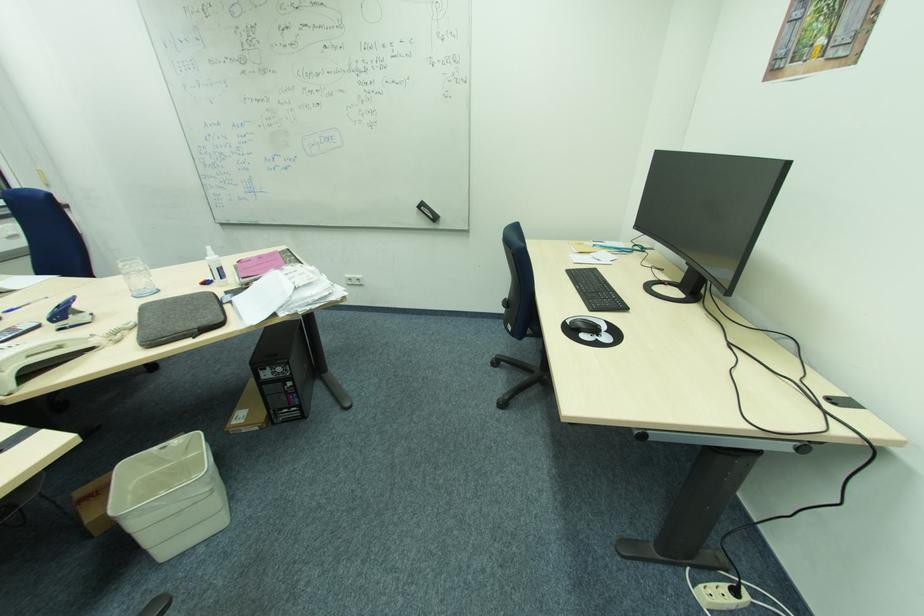
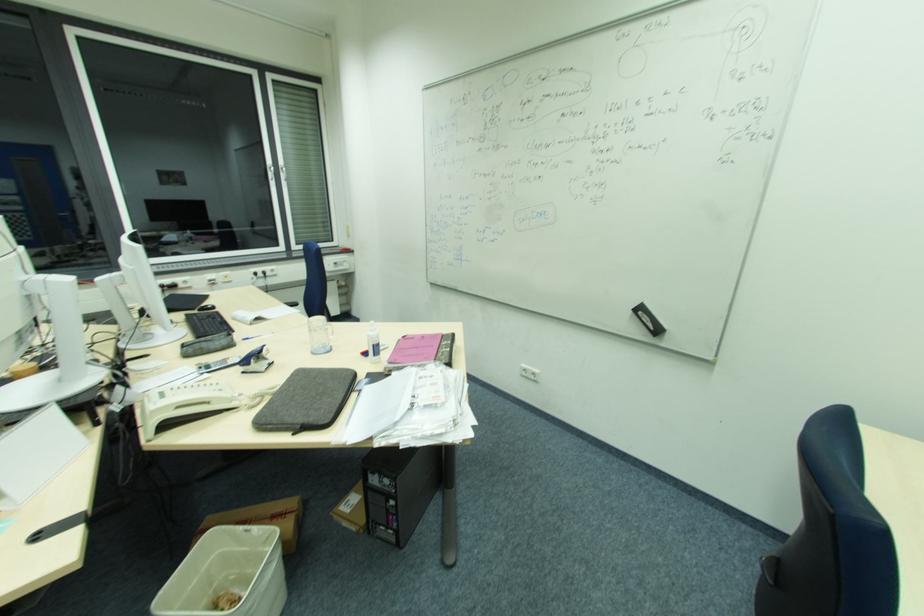
Locate, in the second image, the point that corresponds to [238,262] in the first image.

(403, 338)